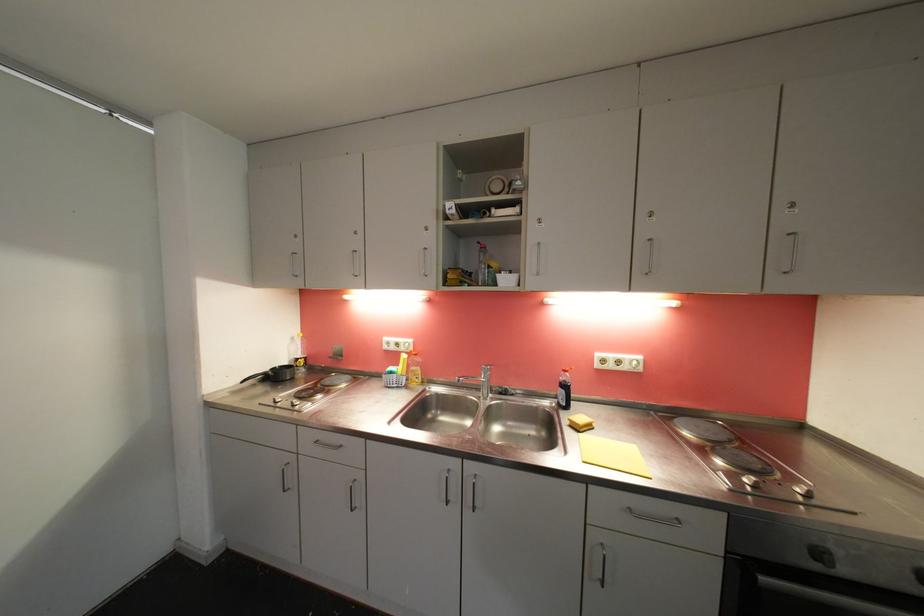
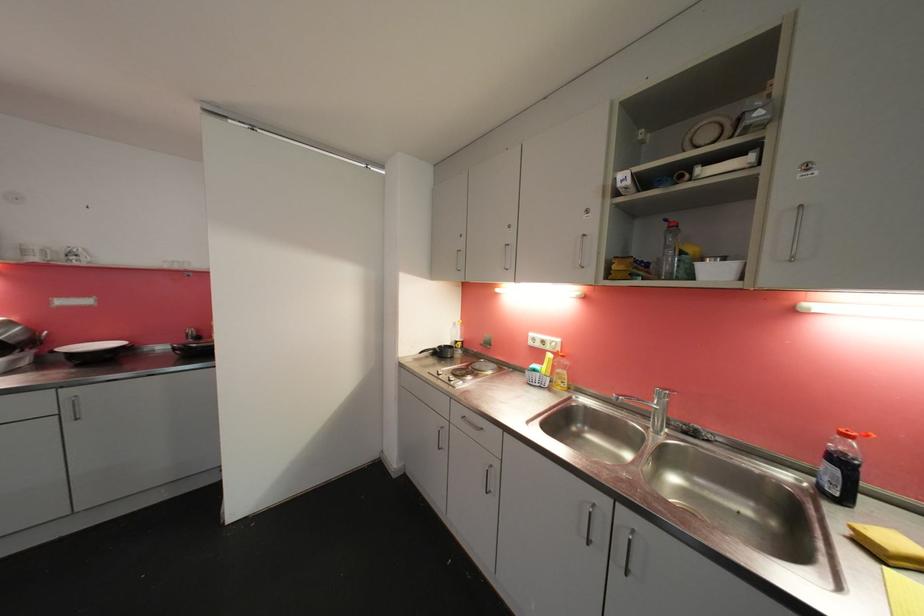
The point at (408, 359) is marked in the first image. Where is the corresponding point in the second image?

(554, 358)